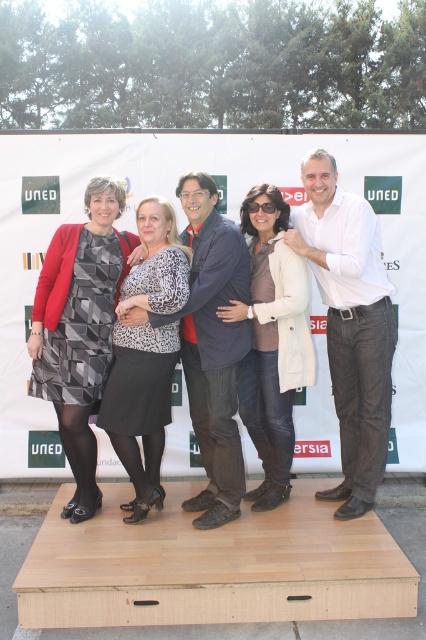
You are a photographer standing at the origin point of the coordinate system. You need to position yourself to take a photo of the matte black dress at center. What are the coordinates where you should aim your camera?

The coordinates to aim your camera are at point (80, 328), which is the 2D location of the matte black dress at center.

Looking at this image, you are organizing a photo shoot and need to place two white garments, the white cotton shirt at center and the white matte jacket at center, in a way that they are aligned with the UNED banner in the background. Which garment should be placed to the right to match their current positions?

The white cotton shirt at center should be placed to the right of the white matte jacket at center to match their current positions.